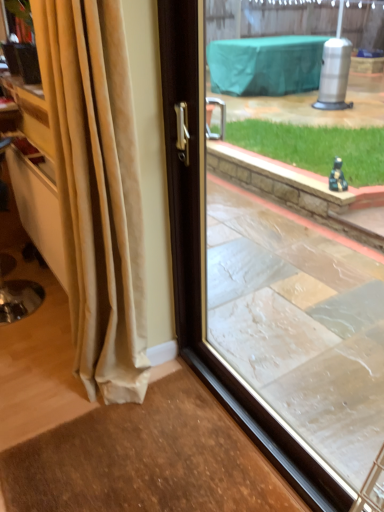
Question: From a real-world perspective, is beige velvet curtain at left on top of transparent glass window at center?

Choices:
 (A) yes
 (B) no

Answer: (B)

Question: Can you see beige velvet curtain at left touching transparent glass window at center?

Choices:
 (A) yes
 (B) no

Answer: (B)

Question: Considering the relative positions of beige velvet curtain at left and transparent glass window at center in the image provided, is beige velvet curtain at left to the right of transparent glass window at center from the viewer's perspective?

Choices:
 (A) yes
 (B) no

Answer: (B)

Question: Is beige velvet curtain at left thinner than transparent glass window at center?

Choices:
 (A) no
 (B) yes

Answer: (A)

Question: Considering the relative positions of beige velvet curtain at left and transparent glass window at center in the image provided, is beige velvet curtain at left behind transparent glass window at center?

Choices:
 (A) no
 (B) yes

Answer: (B)

Question: Does beige velvet curtain at left have a lesser height compared to transparent glass window at center?

Choices:
 (A) yes
 (B) no

Answer: (B)

Question: Would you say transparent glass window at center is a long distance from beige velvet curtain at left?

Choices:
 (A) yes
 (B) no

Answer: (B)

Question: Would you say transparent glass window at center is outside beige velvet curtain at left?

Choices:
 (A) yes
 (B) no

Answer: (A)

Question: Is transparent glass window at center in contact with beige velvet curtain at left?

Choices:
 (A) yes
 (B) no

Answer: (B)

Question: Can you confirm if transparent glass window at center is smaller than beige velvet curtain at left?

Choices:
 (A) no
 (B) yes

Answer: (B)

Question: Is transparent glass window at center positioned in front of beige velvet curtain at left?

Choices:
 (A) yes
 (B) no

Answer: (A)

Question: Is transparent glass window at center oriented away from beige velvet curtain at left?

Choices:
 (A) no
 (B) yes

Answer: (A)

Question: From their relative heights in the image, would you say transparent glass window at center is taller or shorter than beige velvet curtain at left?

Choices:
 (A) tall
 (B) short

Answer: (B)